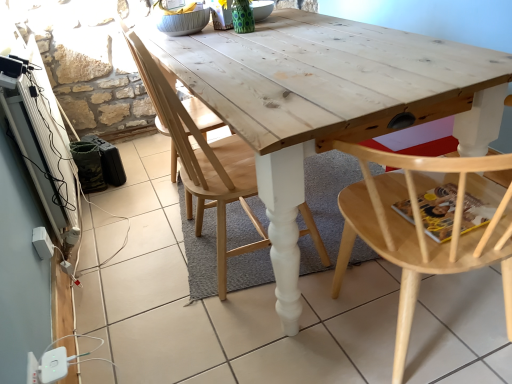
This screenshot has height=384, width=512. In order to click on vacant area situated below natural wood chair at center, which ranks as the third chair in left-to-right order (from a real-world perspective) in this screenshot , I will do `click(434, 328)`.